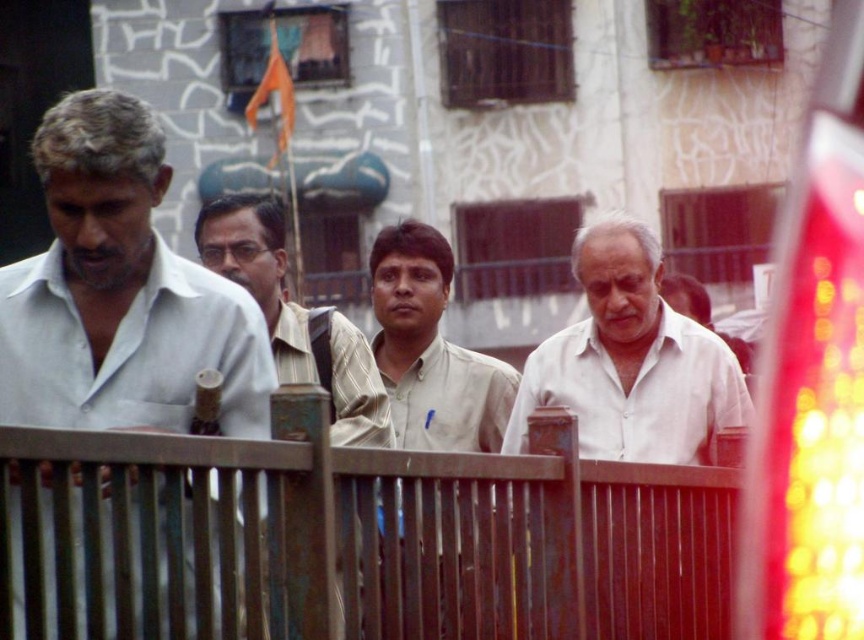
Can you confirm if white matte shirt at left is thinner than light brown shirt at center?

Incorrect, white matte shirt at left's width is not less than light brown shirt at center's.

Identify the location of white matte shirt at left. This screenshot has width=864, height=640. (119, 292).

Where is `white matte shirt at left`? The height and width of the screenshot is (640, 864). white matte shirt at left is located at coordinates pyautogui.click(x=119, y=292).

Is rusty metal fence at center shorter than light brown shirt at center?

Yes, rusty metal fence at center is shorter than light brown shirt at center.

Between point (115, 502) and point (453, 426), which one is positioned behind?

The point (453, 426) is behind.

This screenshot has width=864, height=640. What are the coordinates of `rusty metal fence at center` in the screenshot? It's located at (369, 538).

Between point (637, 378) and point (297, 314), which one is positioned behind?

Positioned behind is point (297, 314).

Between white matte shirt at center and striped fabric shirt at center, which one has less height?

white matte shirt at center

What do you see at coordinates (631, 360) in the screenshot? I see `white matte shirt at center` at bounding box center [631, 360].

The image size is (864, 640). Find the location of `white matte shirt at center`. white matte shirt at center is located at coordinates (631, 360).